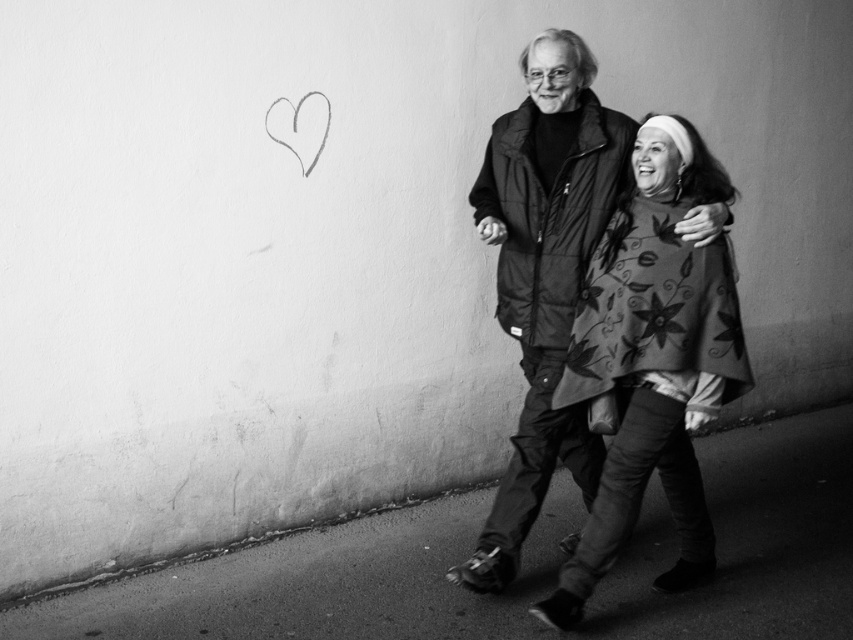
Question: Does smooth asphalt at lower center lie behind gray sketch heart at upper left?

Choices:
 (A) no
 (B) yes

Answer: (A)

Question: Does smooth asphalt at lower center have a greater width compared to matte black jacket at center?

Choices:
 (A) yes
 (B) no

Answer: (A)

Question: Can you confirm if matte black jacket at center is positioned to the right of gray sketch heart at upper left?

Choices:
 (A) yes
 (B) no

Answer: (A)

Question: Which of these objects is positioned farthest from the matte black jacket at center?

Choices:
 (A) floral-patterned fabric cape at center-right
 (B) gray sketch heart at upper left

Answer: (B)

Question: Based on their relative distances, which object is nearer to the smooth asphalt at lower center?

Choices:
 (A) floral-patterned fabric cape at center-right
 (B) matte black jacket at center
 (C) gray sketch heart at upper left

Answer: (A)

Question: Which object is farther from the camera taking this photo?

Choices:
 (A) floral-patterned fabric cape at center-right
 (B) matte black jacket at center
 (C) smooth asphalt at lower center

Answer: (B)